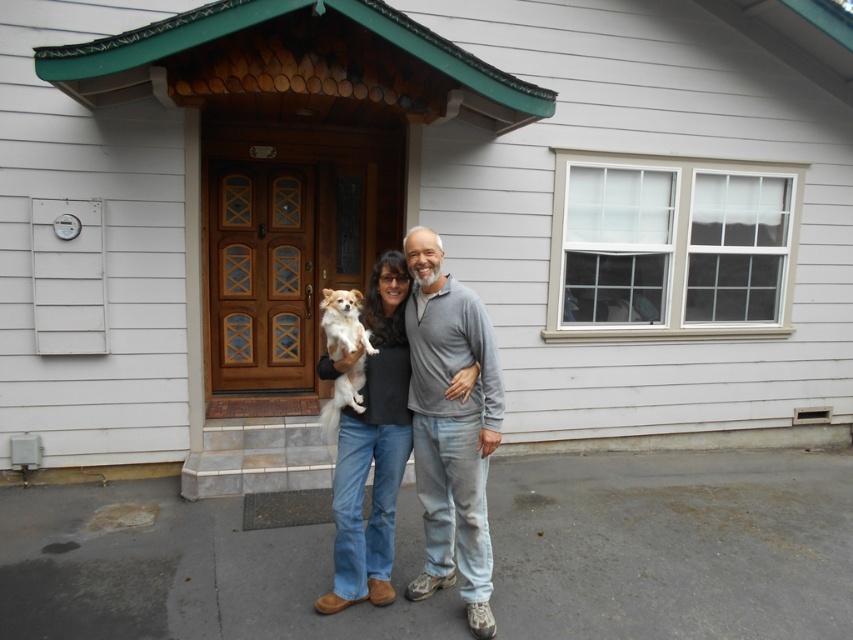
What do you see at coordinates (451, 428) in the screenshot? I see `gray cotton sweater at center` at bounding box center [451, 428].

At what (x,y) coordinates should I click in order to perform the action: click on gray cotton sweater at center. Please return your answer as a coordinate pair (x, y). This screenshot has width=853, height=640. Looking at the image, I should click on (451, 428).

Is matte black shirt at center thinner than fluffy white dog at center?

Incorrect, matte black shirt at center's width is not less than fluffy white dog at center's.

Is matte black shirt at center to the left of fluffy white dog at center from the viewer's perspective?

Incorrect, matte black shirt at center is not on the left side of fluffy white dog at center.

The width and height of the screenshot is (853, 640). What do you see at coordinates (372, 448) in the screenshot?
I see `matte black shirt at center` at bounding box center [372, 448].

You are a GUI agent. You are given a task and a screenshot of the screen. Output one action in this format:
    pyautogui.click(x=<x>, y=<y>)
    Task: Click on the matte black shirt at center
    The height and width of the screenshot is (640, 853).
    Given the screenshot: What is the action you would take?
    pyautogui.click(x=372, y=448)

Is gray cotton sweater at center wider than fluffy white dog at center?

Indeed, gray cotton sweater at center has a greater width compared to fluffy white dog at center.

Does gray cotton sweater at center have a lesser width compared to fluffy white dog at center?

In fact, gray cotton sweater at center might be wider than fluffy white dog at center.

Between point (448, 584) and point (326, 417), which one is positioned behind?

The point (448, 584) is more distant.

Find the location of a particular element. Image resolution: width=853 pixels, height=640 pixels. gray cotton sweater at center is located at coordinates (451, 428).